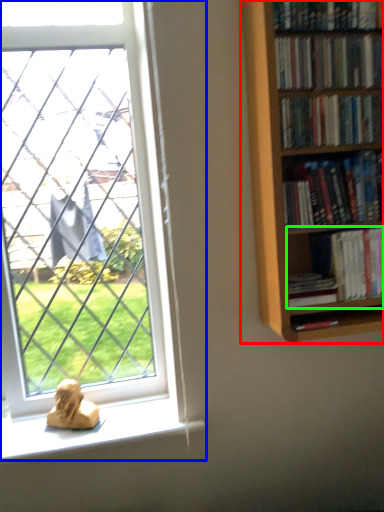
Question: Which is nearer to the bookcase (highlighted by a red box)? window (highlighted by a blue box) or book (highlighted by a green box).

Choices:
 (A) window
 (B) book

Answer: (B)